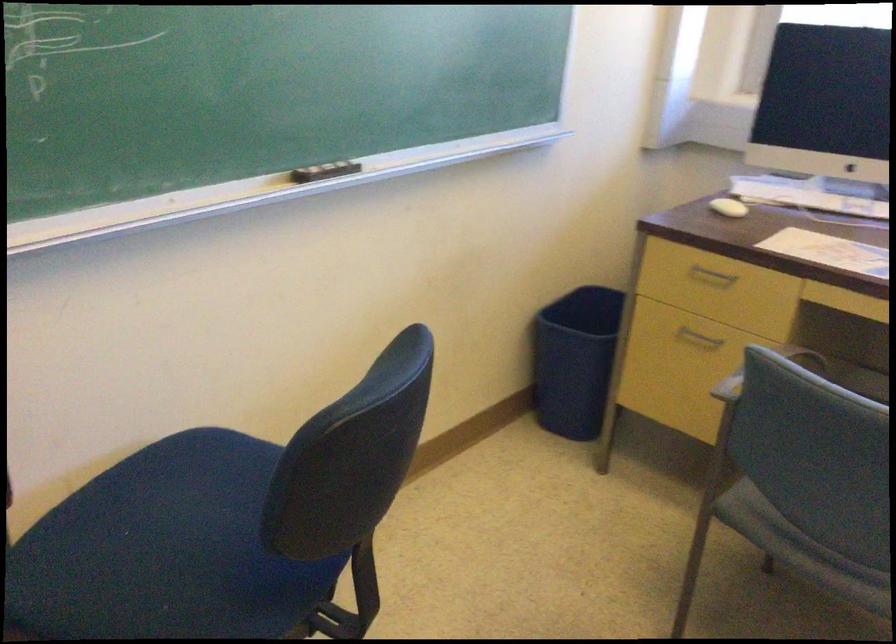
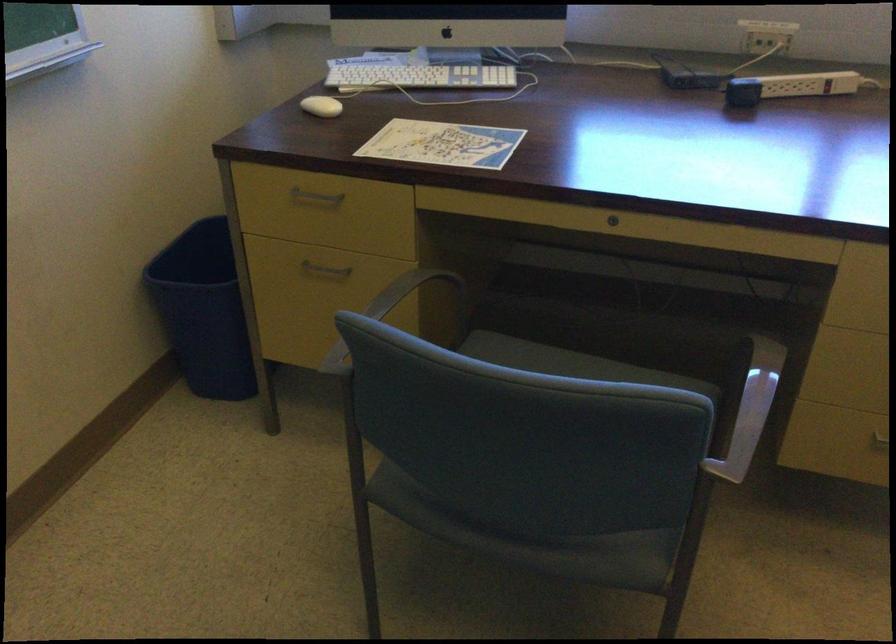
Locate, in the second image, the point that corresponds to point 735,203 in the first image.

(321, 106)